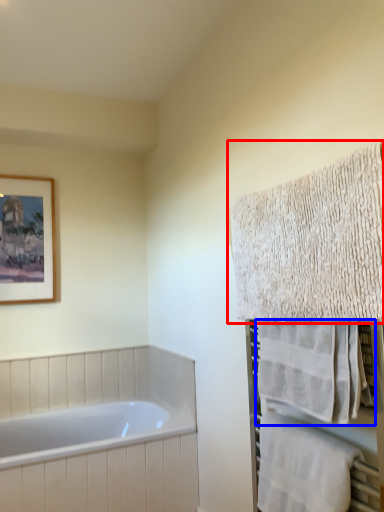
Question: Among these objects, which one is farthest to the camera, towel (highlighted by a red box) or towel (highlighted by a blue box)?

Choices:
 (A) towel
 (B) towel

Answer: (B)